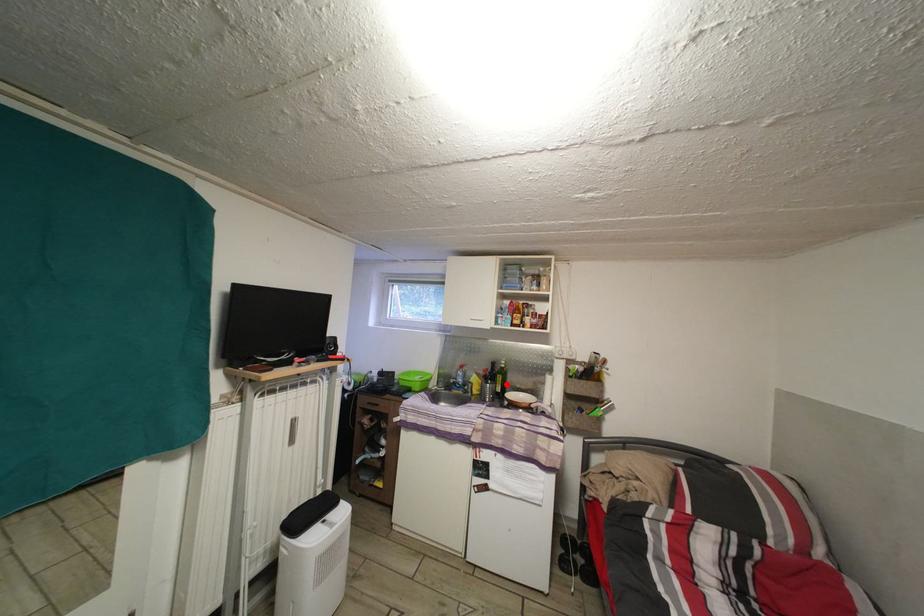
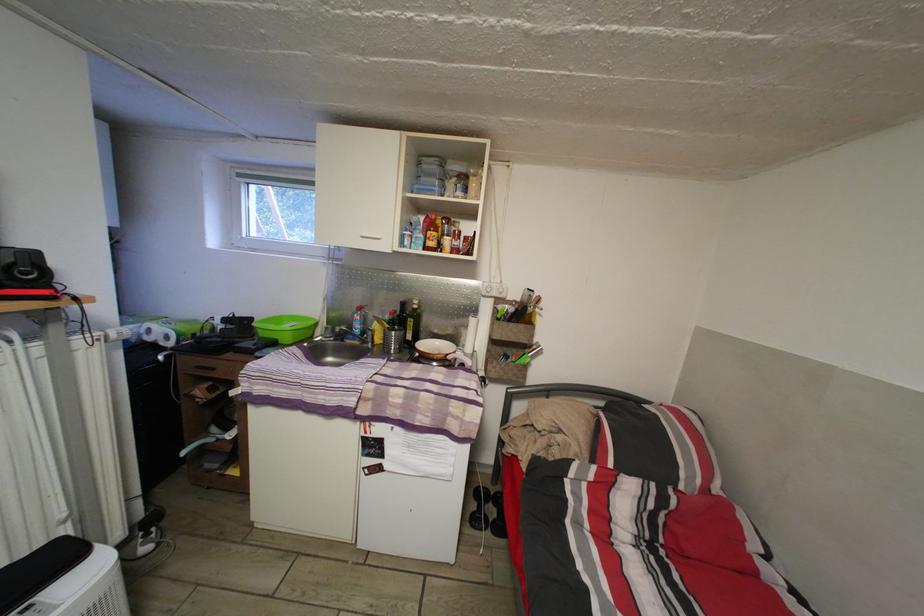
Question: I am providing you with two images of the same scene from different viewpoints. In image1, a red point is highlighted. Considering the same 3D point in image2, which of the following is correct?

Choices:
 (A) It is closer
 (B) It is farther

Answer: (A)